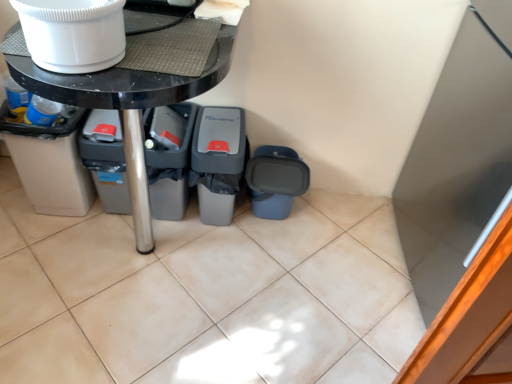
Find the location of `free location in front of gray plastic recycling bin at center, which is the second recycling bin from right to left`. free location in front of gray plastic recycling bin at center, which is the second recycling bin from right to left is located at coordinates (210, 248).